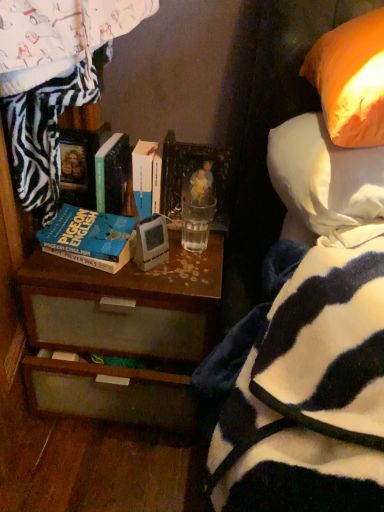
You are a GUI agent. You are given a task and a screenshot of the screen. Output one action in this format:
    pyautogui.click(x=<x>, y=<y>)
    Task: Click on the free space in front of matte plastic picture frame at upper center
    Image resolution: width=384 pixels, height=512 pixels.
    Given the screenshot: What is the action you would take?
    pyautogui.click(x=197, y=259)